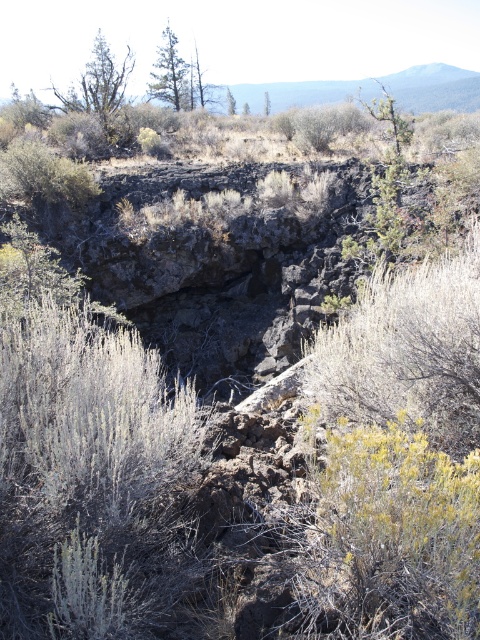
Question: Considering the relative positions of green leafy tree at upper left and green leafy tree at upper center in the image provided, where is green leafy tree at upper left located with respect to green leafy tree at upper center?

Choices:
 (A) below
 (B) above

Answer: (B)

Question: Can you confirm if green leafy tree at upper center is positioned to the left of green leafy tree at center?

Choices:
 (A) no
 (B) yes

Answer: (B)

Question: Considering the real-world distances, which object is farthest from the green leafy tree at center?

Choices:
 (A) green leafy tree at upper left
 (B) green leafy tree at upper center

Answer: (A)

Question: Can you confirm if green leafy tree at upper center is smaller than green leafy tree at center?

Choices:
 (A) yes
 (B) no

Answer: (B)

Question: Which object is the closest to the green textured tree at upper center?

Choices:
 (A) green leafy tree at upper left
 (B) green leafy tree at center
 (C) green leafy tree at upper center

Answer: (C)

Question: Among these objects, which one is nearest to the camera?

Choices:
 (A) green leafy tree at upper center
 (B) green textured tree at upper center
 (C) green leafy tree at center

Answer: (B)